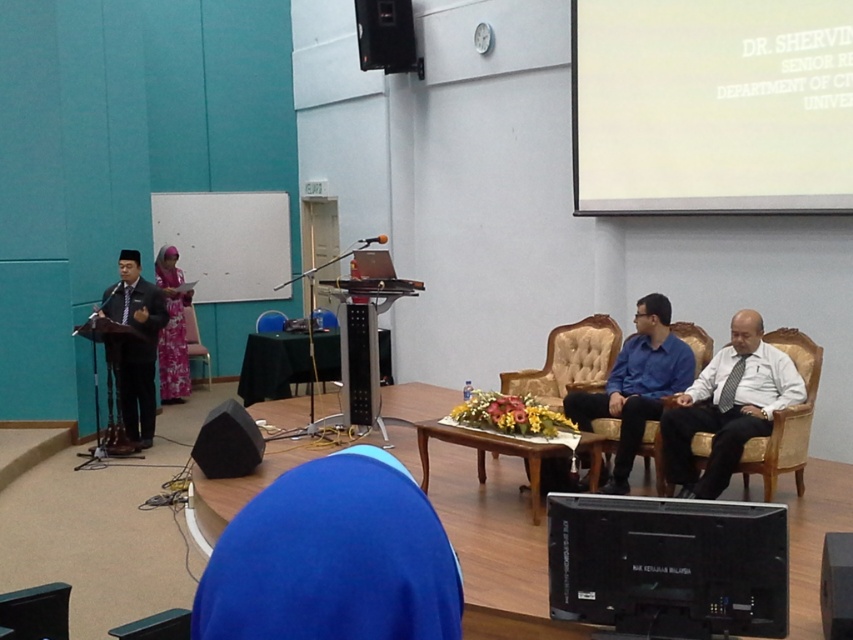
Which is more to the right, white textured shirt at right or blue fabric shirt at center?

From the viewer's perspective, white textured shirt at right appears more on the right side.

Does white textured shirt at right appear under blue fabric shirt at center?

Indeed, white textured shirt at right is positioned under blue fabric shirt at center.

Is point (695, 432) positioned behind point (648, 332)?

No, (695, 432) is in front of (648, 332).

Locate an element on the screen. The image size is (853, 640). white textured shirt at right is located at coordinates (727, 406).

Which is more to the right, blue fabric at lower center or blue fabric shirt at center?

blue fabric shirt at center is more to the right.

Based on the photo, does blue fabric at lower center have a smaller size compared to blue fabric shirt at center?

Yes, blue fabric at lower center is smaller than blue fabric shirt at center.

What do you see at coordinates (332, 557) in the screenshot?
I see `blue fabric at lower center` at bounding box center [332, 557].

Where is `blue fabric at lower center`? blue fabric at lower center is located at coordinates (332, 557).

Is black leather armchair at lower left above black wood speaker at lower right?

Correct, black leather armchair at lower left is located above black wood speaker at lower right.

Is point (44, 637) less distant than point (840, 532)?

Yes, it is in front of point (840, 532).

Is point (56, 624) positioned after point (819, 580)?

No, (56, 624) is in front of (819, 580).

The height and width of the screenshot is (640, 853). In order to click on black leather armchair at lower left in this screenshot , I will do `click(36, 611)`.